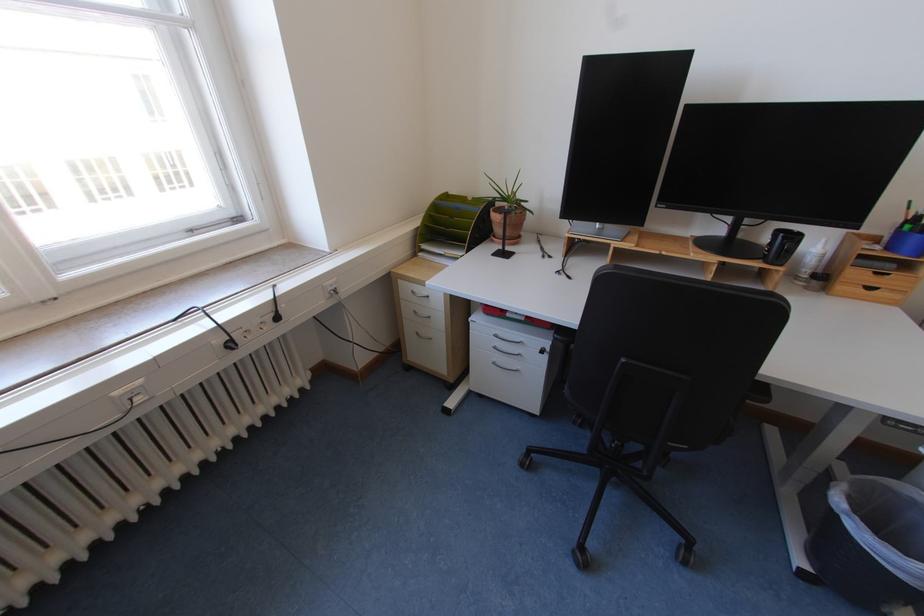
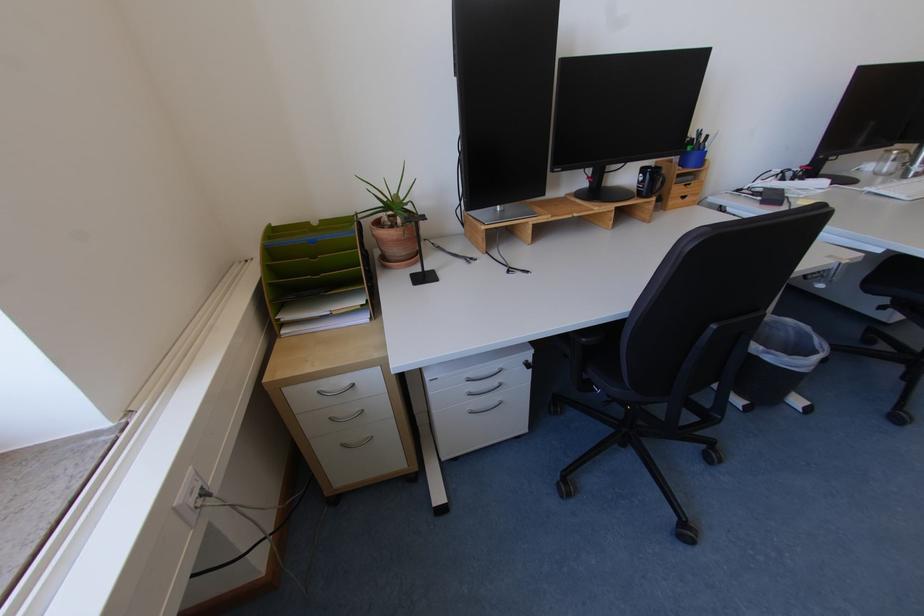
In the second image, find the point that corresponds to [426,334] in the first image.

(350, 446)